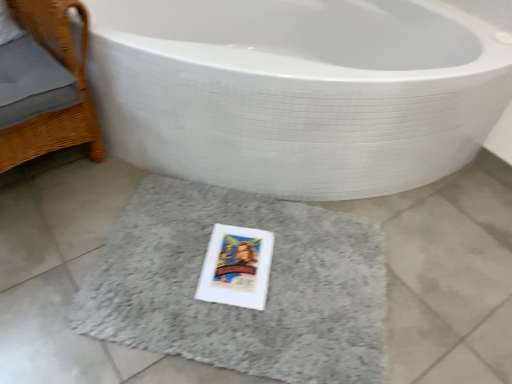
Question: From a real-world perspective, is woven wood chair at left physically located above or below white glossy bathtub at center?

Choices:
 (A) below
 (B) above

Answer: (B)

Question: Is woven wood chair at left situated inside white glossy bathtub at center or outside?

Choices:
 (A) outside
 (B) inside

Answer: (A)

Question: Considering the real-world distances, which object is farthest from the woven wood chair at left?

Choices:
 (A) white glossy bathtub at center
 (B) gray shaggy bath mat at center

Answer: (B)

Question: Which object is the farthest from the gray shaggy bath mat at center?

Choices:
 (A) white glossy bathtub at center
 (B) woven wood chair at left

Answer: (B)